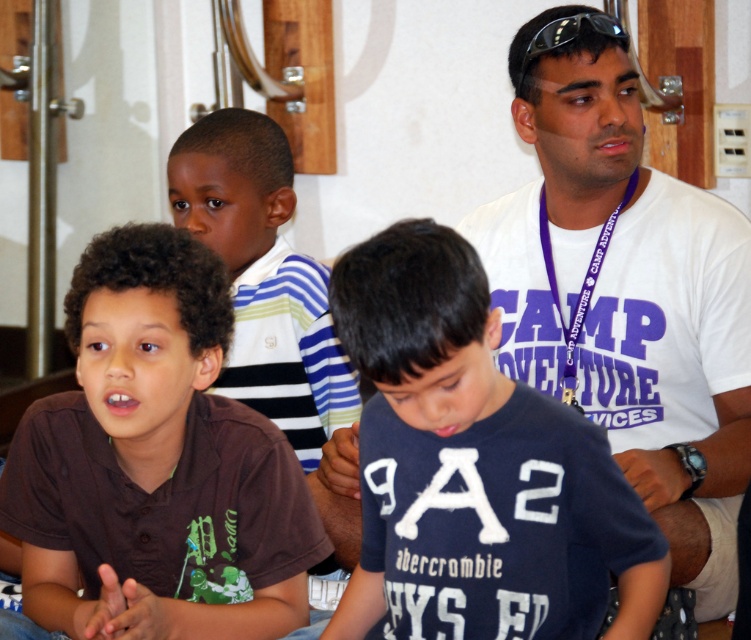
Question: Which of the following is the closest to the observer?

Choices:
 (A) (520, 486)
 (B) (730, 342)
 (C) (258, 595)

Answer: (A)

Question: Is brown cotton shirt at lower left behind dark blue cotton shirt at center?

Choices:
 (A) no
 (B) yes

Answer: (B)

Question: Is brown cotton shirt at lower left further to the viewer compared to dark blue cotton shirt at center?

Choices:
 (A) yes
 (B) no

Answer: (A)

Question: Which point appears farthest from the camera in this image?

Choices:
 (A) (668, 353)
 (B) (222, 422)

Answer: (A)

Question: Which object appears farthest from the camera in this image?

Choices:
 (A) white cotton t-shirt at center
 (B) dark blue cotton shirt at center
 (C) brown cotton shirt at lower left

Answer: (A)

Question: Where is brown cotton shirt at lower left located in relation to white cotton t-shirt at center in the image?

Choices:
 (A) below
 (B) above

Answer: (A)